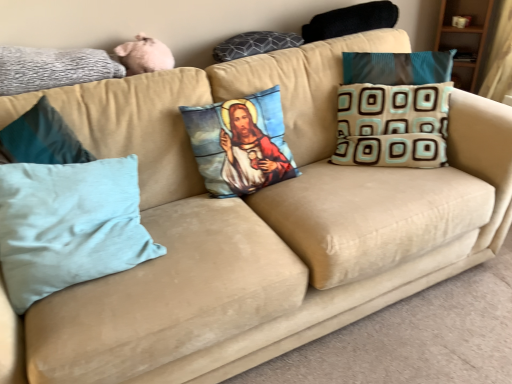
Question: Is black fuzzy pillow at upper right, marked as the second pillow in a right-to-left arrangement, positioned far away from dark gray textured pillow at upper center, placed as the 3th pillow when sorted from right to left?

Choices:
 (A) yes
 (B) no

Answer: (B)

Question: Is black fuzzy pillow at upper right, which appears as the 5th pillow when viewed from the left, oriented away from dark gray textured pillow at upper center, placed as the 3th pillow when sorted from right to left?

Choices:
 (A) no
 (B) yes

Answer: (A)

Question: Considering the relative positions of black fuzzy pillow at upper right, marked as the second pillow in a right-to-left arrangement, and dark gray textured pillow at upper center, placed as the 3th pillow when sorted from right to left, in the image provided, is black fuzzy pillow at upper right, marked as the second pillow in a right-to-left arrangement, behind dark gray textured pillow at upper center, placed as the 3th pillow when sorted from right to left,?

Choices:
 (A) yes
 (B) no

Answer: (A)

Question: Is black fuzzy pillow at upper right, which appears as the 5th pillow when viewed from the left, thinner than dark gray textured pillow at upper center, which ranks as the fourth pillow in left-to-right order?

Choices:
 (A) no
 (B) yes

Answer: (A)

Question: Is black fuzzy pillow at upper right, marked as the second pillow in a right-to-left arrangement, to the left of dark gray textured pillow at upper center, placed as the 3th pillow when sorted from right to left, from the viewer's perspective?

Choices:
 (A) yes
 (B) no

Answer: (B)

Question: Visually, is dark gray textured pillow at upper center, which ranks as the fourth pillow in left-to-right order, positioned to the left or to the right of beige fabric pillow with blue and brown squares at right, which appears as the first pillow when viewed from the right?

Choices:
 (A) left
 (B) right

Answer: (A)

Question: Is dark gray textured pillow at upper center, placed as the 3th pillow when sorted from right to left, bigger or smaller than beige fabric pillow with blue and brown squares at right, acting as the 6th pillow starting from the left?

Choices:
 (A) small
 (B) big

Answer: (A)

Question: From a real-world perspective, is dark gray textured pillow at upper center, placed as the 3th pillow when sorted from right to left, above or below beige fabric pillow with blue and brown squares at right, acting as the 6th pillow starting from the left?

Choices:
 (A) below
 (B) above

Answer: (B)

Question: From their relative heights in the image, would you say dark gray textured pillow at upper center, which ranks as the fourth pillow in left-to-right order, is taller or shorter than beige fabric pillow with blue and brown squares at right, which appears as the first pillow when viewed from the right?

Choices:
 (A) tall
 (B) short

Answer: (B)

Question: Do you think light blue fabric pillow at left, which ranks as the second pillow in left-to-right order, is within gray textured pillow at upper left, which ranks as the 6th pillow in right-to-left order, or outside of it?

Choices:
 (A) outside
 (B) inside

Answer: (A)

Question: In terms of width, does light blue fabric pillow at left, which is counted as the fifth pillow, starting from the right, look wider or thinner when compared to gray textured pillow at upper left, the first pillow in the left-to-right sequence?

Choices:
 (A) thin
 (B) wide

Answer: (B)

Question: Considering the relative positions of light blue fabric pillow at left, which ranks as the second pillow in left-to-right order, and gray textured pillow at upper left, the first pillow in the left-to-right sequence, in the image provided, is light blue fabric pillow at left, which ranks as the second pillow in left-to-right order, to the left or to the right of gray textured pillow at upper left, the first pillow in the left-to-right sequence,?

Choices:
 (A) left
 (B) right

Answer: (B)

Question: From the image's perspective, is light blue fabric pillow at left, which ranks as the second pillow in left-to-right order, located above or below gray textured pillow at upper left, the first pillow in the left-to-right sequence?

Choices:
 (A) above
 (B) below

Answer: (B)

Question: Is printed fabric pillow with religious imagery at center, the fourth pillow in the right-to-left sequence, spatially inside gray textured pillow at upper left, which ranks as the 6th pillow in right-to-left order, or outside of it?

Choices:
 (A) inside
 (B) outside

Answer: (B)

Question: Visually, is printed fabric pillow with religious imagery at center, the fourth pillow in the right-to-left sequence, positioned to the left or to the right of gray textured pillow at upper left, which ranks as the 6th pillow in right-to-left order?

Choices:
 (A) left
 (B) right

Answer: (B)